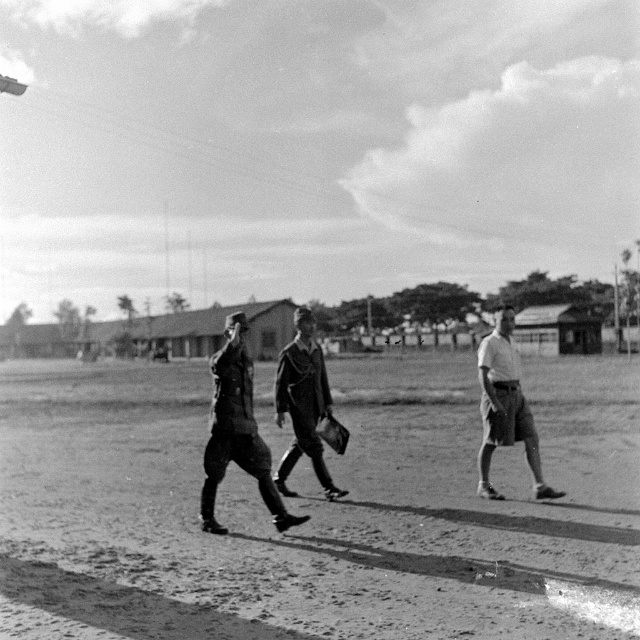
You are taking a photo of the scene and want to focus on both point (x=493, y=444) and point (x=307, y=362). Which point should you focus on first to ensure both are in focus?

You should focus on point (x=493, y=444) first because it is closer to the camera than point (x=307, y=362), so focusing on the closer point will help ensure both are in focus.

You are a photographer trying to capture a group photo of the dark gray uniform at center and the light gray shorts at right. If your camera has a minimum focus distance of 8 feet, will you be able to take a clear photo of both subjects without moving either of them?

The dark gray uniform at center is 8.77 feet from the light gray shorts at right. Since the distance between them is greater than the camera minimum focus distance of 8 feet, the photographer can take a clear photo of both subjects without moving them.